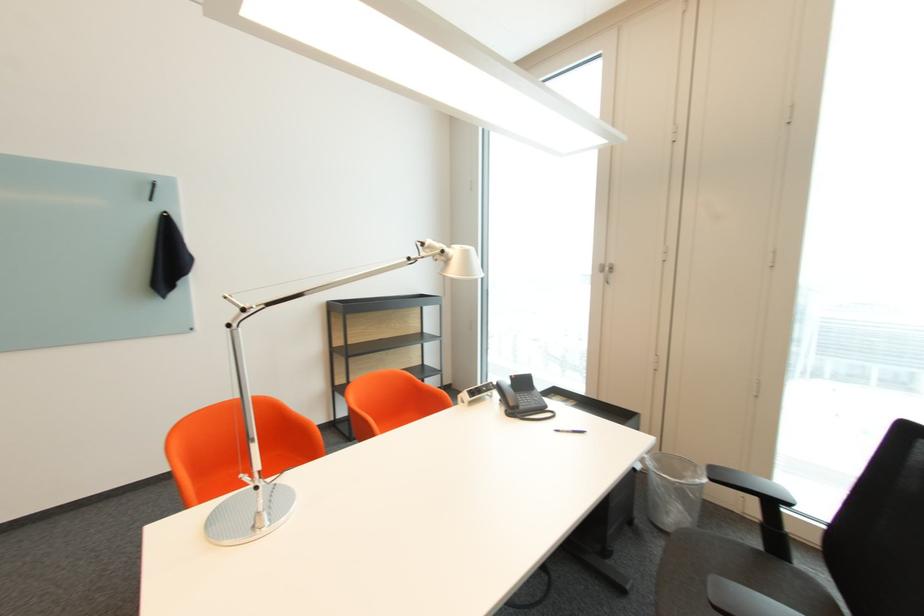
The height and width of the screenshot is (616, 924). Find the location of `black chair sitting surface`. black chair sitting surface is located at coordinates (723, 554).